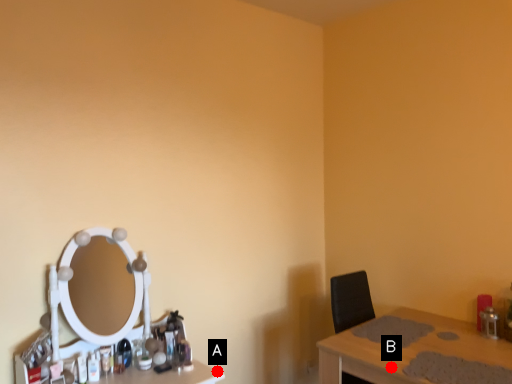
Question: Two points are circled on the image, labeled by A and B beside each circle. Which point is farther from the camera taking this photo?

Choices:
 (A) A is further
 (B) B is further

Answer: (A)